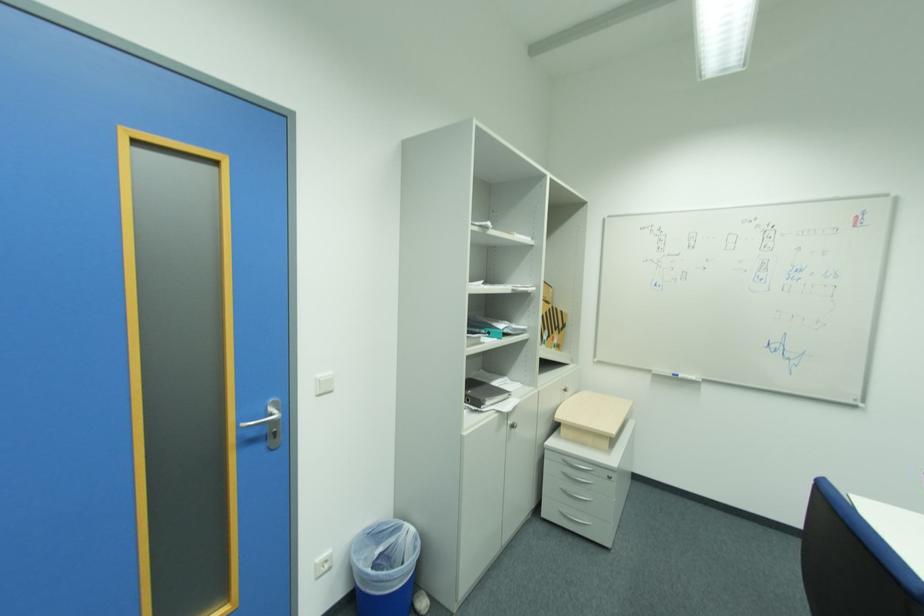
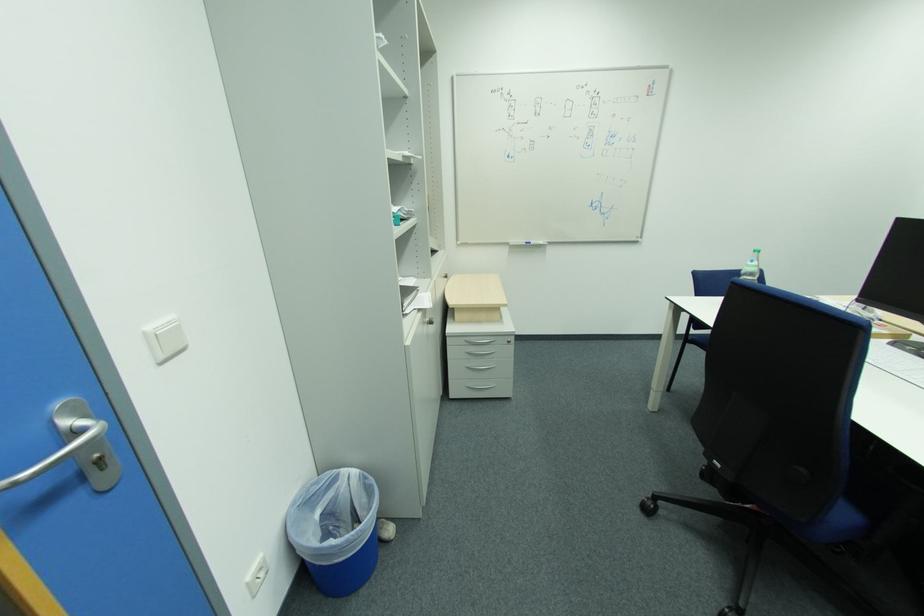
The point at (276, 448) is marked in the first image. Where is the corresponding point in the second image?

(111, 488)